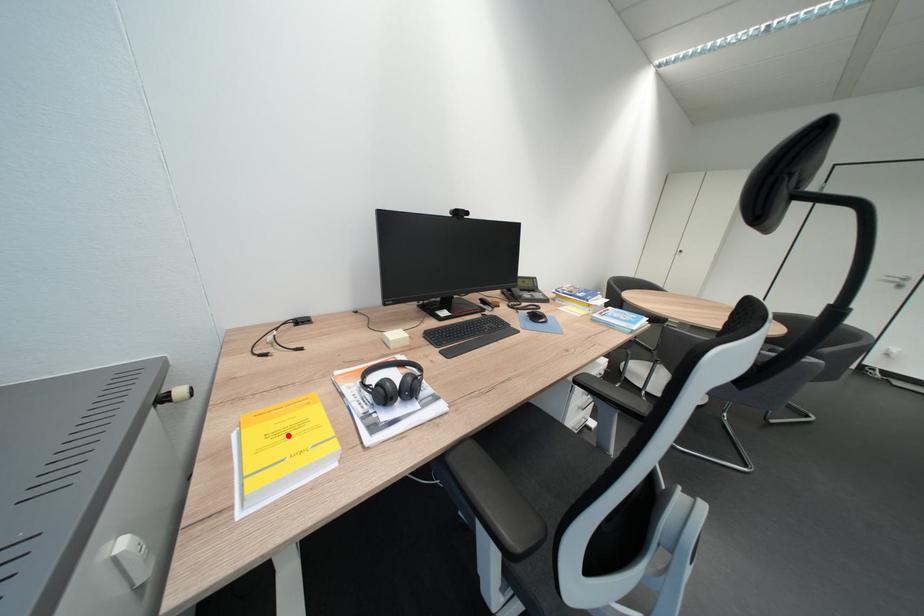
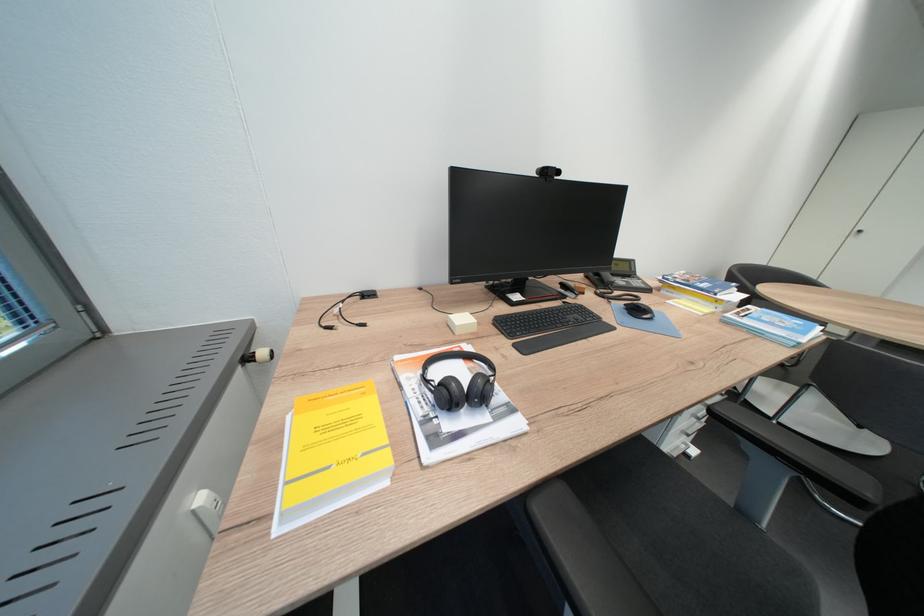
Find the pixel in the second image that matches the highlighted location in the first image.

(338, 430)